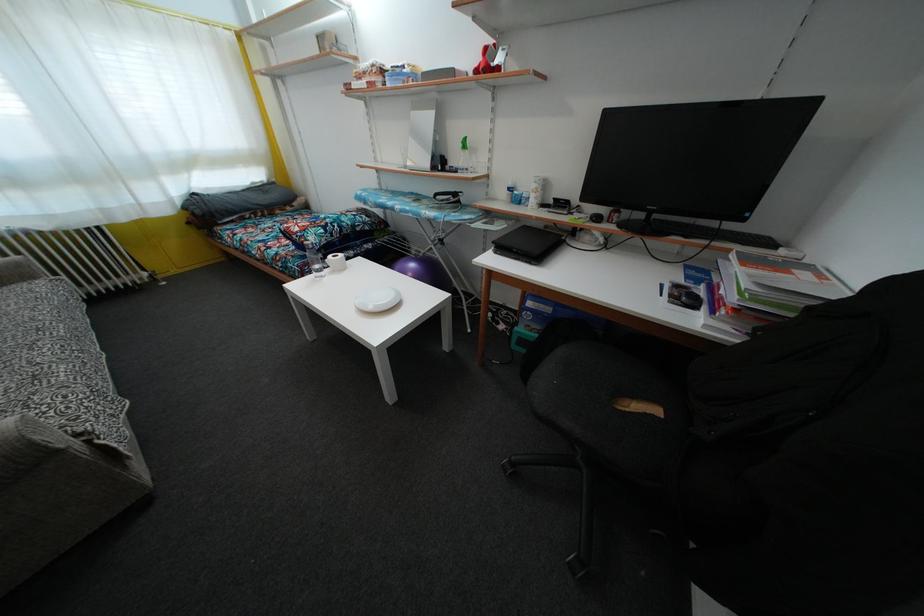
Locate an element on the screen. The width and height of the screenshot is (924, 616). black chair sitting surface is located at coordinates (609, 403).